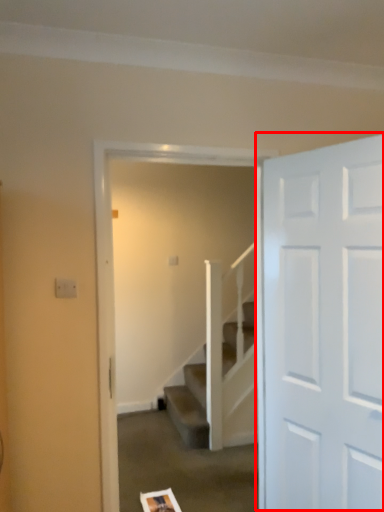
Question: Considering the relative positions of door (annotated by the red box) and screen door in the image provided, where is door (annotated by the red box) located with respect to the staircase?

Choices:
 (A) left
 (B) right

Answer: (B)